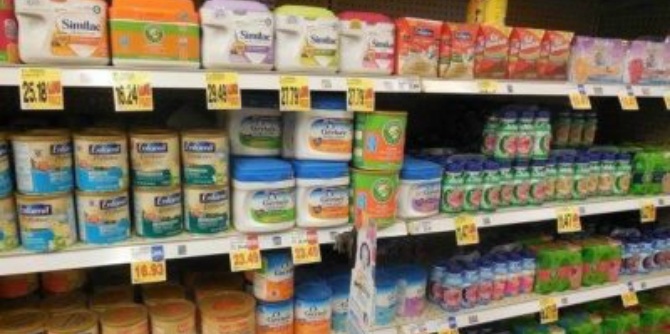
Image resolution: width=670 pixels, height=334 pixels. Identify the location of shelf wall. (534, 19).